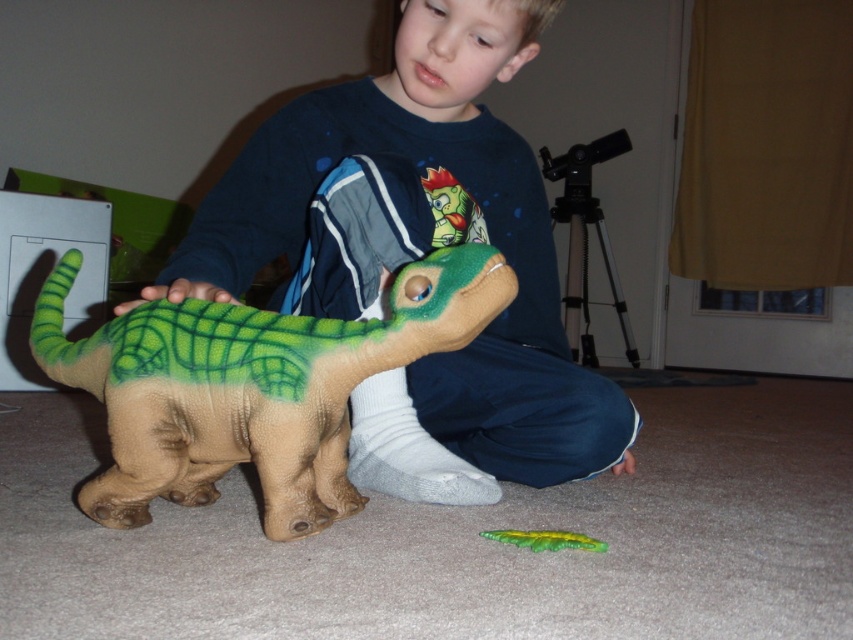
Question: Does soft plush dinosaur at center appear over green matte toy at lower center?

Choices:
 (A) yes
 (B) no

Answer: (A)

Question: Does green matte dinosaur at lower left have a greater width compared to green matte toy at lower center?

Choices:
 (A) yes
 (B) no

Answer: (A)

Question: Is the position of soft plush dinosaur at center less distant than that of green matte dinosaur at lower left?

Choices:
 (A) yes
 (B) no

Answer: (B)

Question: Which object appears closest to the camera in this image?

Choices:
 (A) green matte dinosaur at lower left
 (B) soft plush dinosaur at center

Answer: (A)

Question: Which point is farther to the camera?

Choices:
 (A) (131, 420)
 (B) (583, 545)
 (C) (380, 490)

Answer: (C)

Question: Which point is farther to the camera?

Choices:
 (A) green matte toy at lower center
 (B) soft plush dinosaur at center
 (C) green matte dinosaur at lower left

Answer: (A)